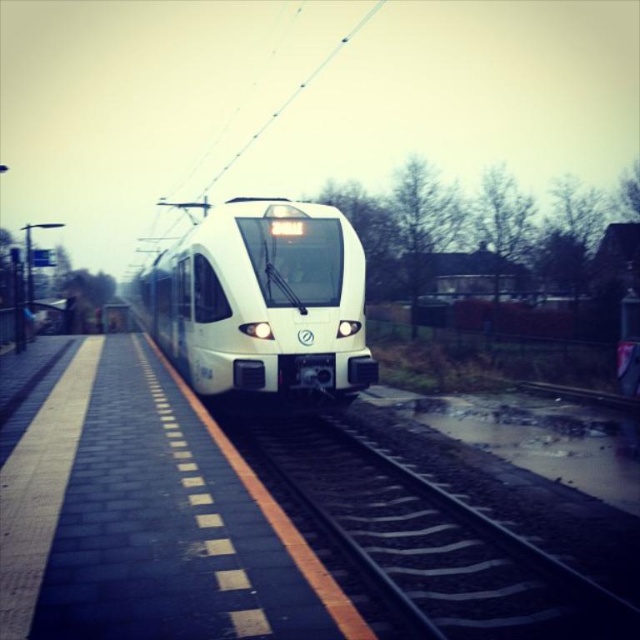
Question: Which point is farther from the camera taking this photo?

Choices:
 (A) pos(323,228)
 (B) pos(449,611)

Answer: (A)

Question: Which of the following is the closest to the observer?

Choices:
 (A) black metal train track at center
 (B) white glossy train at center

Answer: (A)

Question: Observing the image, what is the correct spatial positioning of black metal train track at center in reference to white glossy train at center?

Choices:
 (A) right
 (B) left

Answer: (A)

Question: Which point is closer to the camera?

Choices:
 (A) white glossy train at center
 (B) black metal train track at center

Answer: (B)

Question: Is black metal train track at center below white glossy train at center?

Choices:
 (A) no
 (B) yes

Answer: (B)

Question: Where is black metal train track at center located in relation to white glossy train at center in the image?

Choices:
 (A) right
 (B) left

Answer: (A)